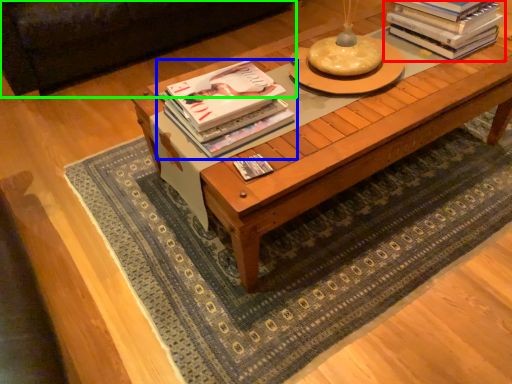
Question: Which is nearer to the book (highlighted by a red box)? book (highlighted by a blue box) or couch (highlighted by a green box).

Choices:
 (A) book
 (B) couch

Answer: (A)